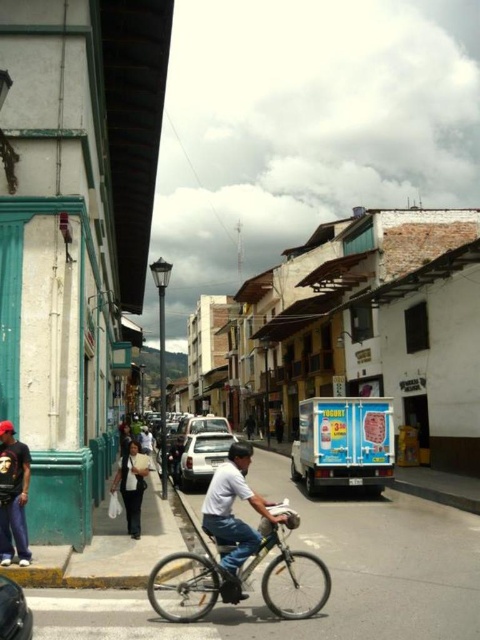
Between denim jeans at center and dark blue jeans at lower left, which one is positioned lower?

denim jeans at center is lower down.

Who is higher up, denim jeans at center or dark blue jeans at lower left?

Positioned higher is dark blue jeans at lower left.

This screenshot has height=640, width=480. I want to click on denim jeans at center, so click(x=233, y=516).

This screenshot has width=480, height=640. I want to click on denim jeans at center, so click(233, 516).

This screenshot has width=480, height=640. Describe the element at coordinates (186, 586) in the screenshot. I see `silver metallic bicycle at center` at that location.

Which is more to the right, silver metallic bicycle at center or dark blue jeans at lower left?

silver metallic bicycle at center is more to the right.

Who is more forward, (223, 545) or (17, 468)?

Point (223, 545) is in front.

This screenshot has height=640, width=480. Find the location of `silver metallic bicycle at center`. silver metallic bicycle at center is located at coordinates (186, 586).

Looking at this image, does silver metallic bicycle at center have a greater width compared to shiny black car at lower left?

Correct, the width of silver metallic bicycle at center exceeds that of shiny black car at lower left.

The image size is (480, 640). Describe the element at coordinates (186, 586) in the screenshot. I see `silver metallic bicycle at center` at that location.

This screenshot has width=480, height=640. What are the coordinates of `silver metallic bicycle at center` in the screenshot? It's located at (186, 586).